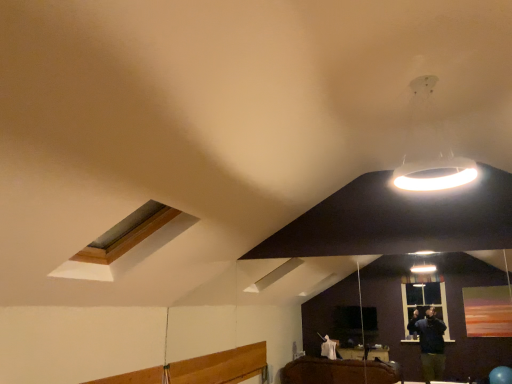
Describe the element at coordinates (429, 147) in the screenshot. This screenshot has width=512, height=384. I see `white glossy ring light at upper right` at that location.

Find the location of `white glossy ring light at upper right`. white glossy ring light at upper right is located at coordinates (429, 147).

The width and height of the screenshot is (512, 384). What do you see at coordinates (127, 233) in the screenshot? I see `wooden-framed skylight at upper left` at bounding box center [127, 233].

What are the coordinates of `wooden-framed skylight at upper left` in the screenshot? It's located at (127, 233).

Locate an element on the screen. white glossy ring light at upper right is located at coordinates (429, 147).

Considering the relative positions of wooden-framed skylight at upper left and white glossy ring light at upper right in the image provided, is wooden-framed skylight at upper left to the right of white glossy ring light at upper right from the viewer's perspective?

In fact, wooden-framed skylight at upper left is to the left of white glossy ring light at upper right.

Is wooden-framed skylight at upper left positioned before white glossy ring light at upper right?

No, it is not.

Is point (148, 225) closer or farther from the camera than point (447, 150)?

Point (148, 225) appears to be closer to the viewer than point (447, 150).

From the image's perspective, is wooden-framed skylight at upper left above or below white glossy ring light at upper right?

Based on their image positions, wooden-framed skylight at upper left is located beneath white glossy ring light at upper right.

From a real-world perspective, between wooden-framed skylight at upper left and white glossy ring light at upper right, who is vertically higher?

From a 3D spatial view, white glossy ring light at upper right is above.

Can you confirm if wooden-framed skylight at upper left is wider than white glossy ring light at upper right?

Indeed, wooden-framed skylight at upper left has a greater width compared to white glossy ring light at upper right.

Considering the sizes of objects wooden-framed skylight at upper left and white glossy ring light at upper right in the image provided, who is shorter, wooden-framed skylight at upper left or white glossy ring light at upper right?

wooden-framed skylight at upper left is shorter.

From the picture: Does wooden-framed skylight at upper left have a larger size compared to white glossy ring light at upper right?

Yes.

Is wooden-framed skylight at upper left inside or outside of white glossy ring light at upper right?

wooden-framed skylight at upper left is not inside white glossy ring light at upper right, it's outside.

Are wooden-framed skylight at upper left and white glossy ring light at upper right beside each other?

No, wooden-framed skylight at upper left is not touching white glossy ring light at upper right.

Is wooden-framed skylight at upper left looking in the opposite direction of white glossy ring light at upper right?

No, white glossy ring light at upper right is not at the back of wooden-framed skylight at upper left.

How different are the orientations of wooden-framed skylight at upper left and white glossy ring light at upper right in degrees?

93.9 degrees.

Find the location of `window on the left of white glossy ring light at upper right`. window on the left of white glossy ring light at upper right is located at coordinates (127, 233).

Based on the photo, which object is positioned more to the left, white glossy ring light at upper right or wooden-framed skylight at upper left?

Positioned to the left is wooden-framed skylight at upper left.

Who is more distant, white glossy ring light at upper right or wooden-framed skylight at upper left?

wooden-framed skylight at upper left is further from the camera.

Does point (432, 77) come in front of point (114, 244)?

Yes.

From the picture: From the image's perspective, is white glossy ring light at upper right located above wooden-framed skylight at upper left?

Yes, from the image's perspective, white glossy ring light at upper right is over wooden-framed skylight at upper left.

From a real-world perspective, is white glossy ring light at upper right positioned above or below wooden-framed skylight at upper left?

white glossy ring light at upper right is situated higher than wooden-framed skylight at upper left in the real world.

In terms of width, does white glossy ring light at upper right look wider or thinner when compared to wooden-framed skylight at upper left?

In the image, white glossy ring light at upper right appears to be more narrow than wooden-framed skylight at upper left.

Considering the sizes of objects white glossy ring light at upper right and wooden-framed skylight at upper left in the image provided, who is taller, white glossy ring light at upper right or wooden-framed skylight at upper left?

white glossy ring light at upper right is taller.

Considering the relative sizes of white glossy ring light at upper right and wooden-framed skylight at upper left in the image provided, is white glossy ring light at upper right bigger than wooden-framed skylight at upper left?

Actually, white glossy ring light at upper right might be smaller than wooden-framed skylight at upper left.

Choose the correct answer: Is white glossy ring light at upper right inside wooden-framed skylight at upper left or outside it?

white glossy ring light at upper right exists outside the volume of wooden-framed skylight at upper left.

Are white glossy ring light at upper right and wooden-framed skylight at upper left beside each other?

white glossy ring light at upper right and wooden-framed skylight at upper left are clearly separated.

Is white glossy ring light at upper right looking in the opposite direction of wooden-framed skylight at upper left?

No.

How much distance is there between white glossy ring light at upper right and wooden-framed skylight at upper left?

The distance of white glossy ring light at upper right from wooden-framed skylight at upper left is 2.33 meters.

Where is `window that is below the white glossy ring light at upper right (from the image's perspective)`? Image resolution: width=512 pixels, height=384 pixels. window that is below the white glossy ring light at upper right (from the image's perspective) is located at coordinates (127, 233).

Find the location of a particular element. Image resolution: width=512 pixels, height=384 pixels. window on the left of white glossy ring light at upper right is located at coordinates (127, 233).

In order to click on lamp that appears above the wooden-framed skylight at upper left (from the image's perspective) in this screenshot , I will do `click(429, 147)`.